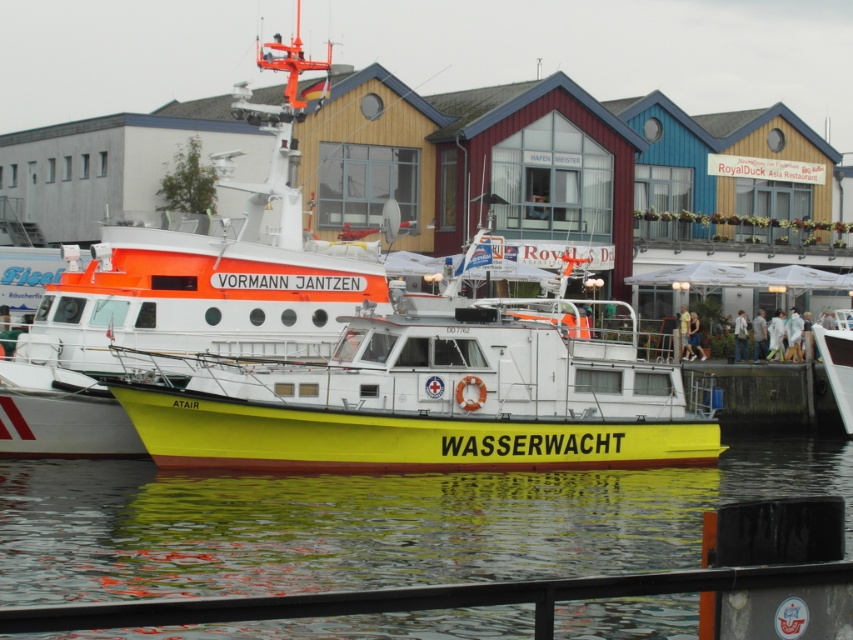
Which is in front, point (584, 433) or point (683, 355)?

Point (584, 433) is in front.

Is yellow matte boat at center above yellow fabric person at right?

Actually, yellow matte boat at center is below yellow fabric person at right.

Image resolution: width=853 pixels, height=640 pixels. What do you see at coordinates (438, 396) in the screenshot? I see `yellow matte boat at center` at bounding box center [438, 396].

Locate an element on the screen. The height and width of the screenshot is (640, 853). yellow matte boat at center is located at coordinates (438, 396).

Does yellow matte water at lower center appear on the right side of yellow fabric person at right?

Incorrect, yellow matte water at lower center is not on the right side of yellow fabric person at right.

Between yellow matte water at lower center and yellow fabric person at right, which one is positioned lower?

yellow matte water at lower center

The height and width of the screenshot is (640, 853). What do you see at coordinates (372, 524) in the screenshot? I see `yellow matte water at lower center` at bounding box center [372, 524].

This screenshot has height=640, width=853. Find the location of `yellow matte water at lower center`. yellow matte water at lower center is located at coordinates (372, 524).

Is point (786, 336) more distant than point (743, 349)?

Yes, it is behind point (743, 349).

Can you confirm if white fabric person at lower right is positioned below white fabric jacket at center?

Indeed, white fabric person at lower right is positioned under white fabric jacket at center.

The width and height of the screenshot is (853, 640). Describe the element at coordinates (793, 336) in the screenshot. I see `white fabric person at lower right` at that location.

Identify the location of white fabric person at lower right. (793, 336).